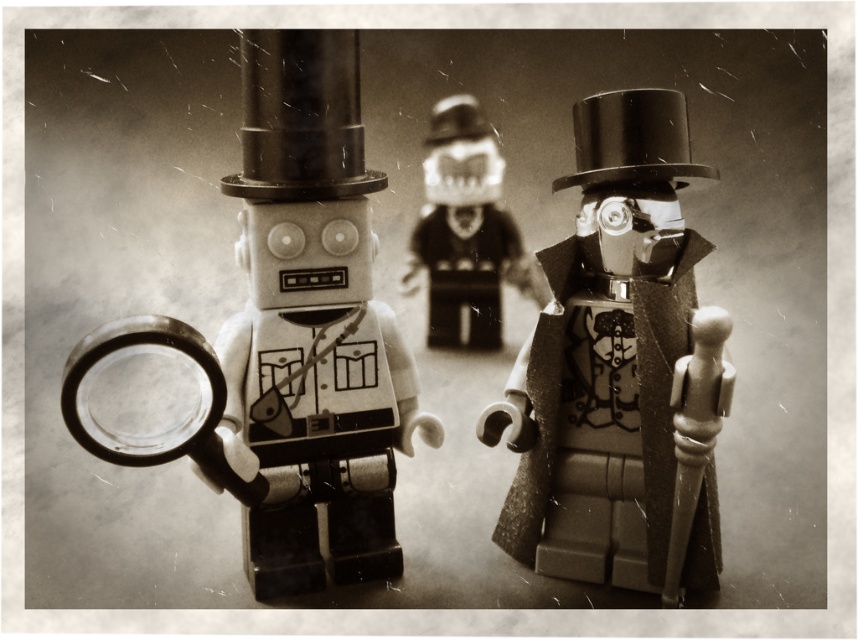
Question: Is matte plastic robot at left closer to camera compared to smooth plastic figure at center?

Choices:
 (A) no
 (B) yes

Answer: (B)

Question: Is matte plastic robot at left thinner than smooth plastic figure at center?

Choices:
 (A) no
 (B) yes

Answer: (A)

Question: Among these points, which one is farthest from the camera?

Choices:
 (A) (335, 141)
 (B) (535, 387)
 (C) (482, 266)
 (D) (179, 438)

Answer: (C)

Question: Which point appears farthest from the camera in this image?

Choices:
 (A) (663, 112)
 (B) (161, 429)
 (C) (351, 60)
 (D) (498, 282)

Answer: (D)

Question: Can you confirm if matte black top hat at center is positioned to the left of smooth plastic figure at center?

Choices:
 (A) no
 (B) yes

Answer: (A)

Question: Estimate the real-world distances between objects in this image. Which object is farther from the matte black top hat at center?

Choices:
 (A) transparent plastic magnifying glass at left
 (B) matte plastic robot at left

Answer: (A)